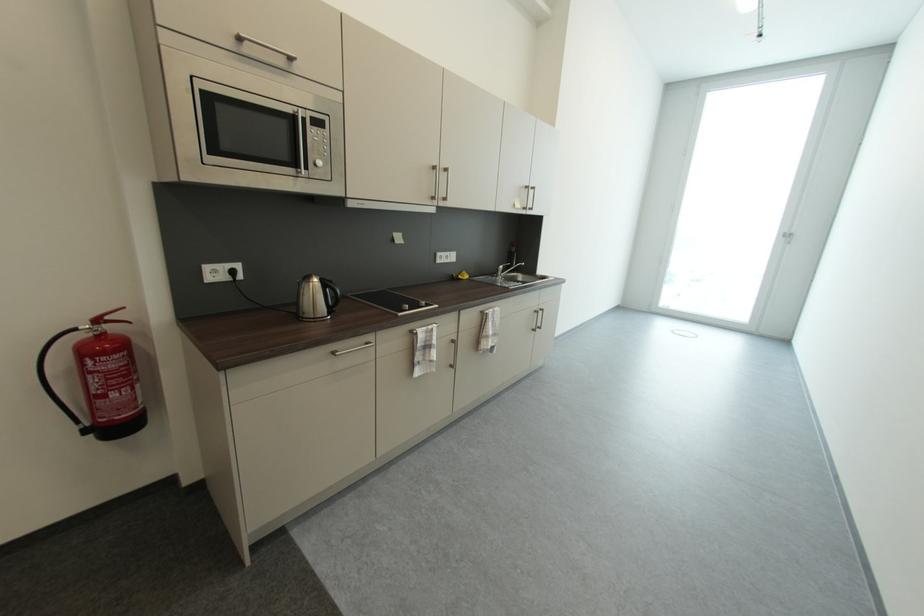
Where would you pull the microwave door handle? Please return your answer as a coordinate pair (x, y).

(302, 142)